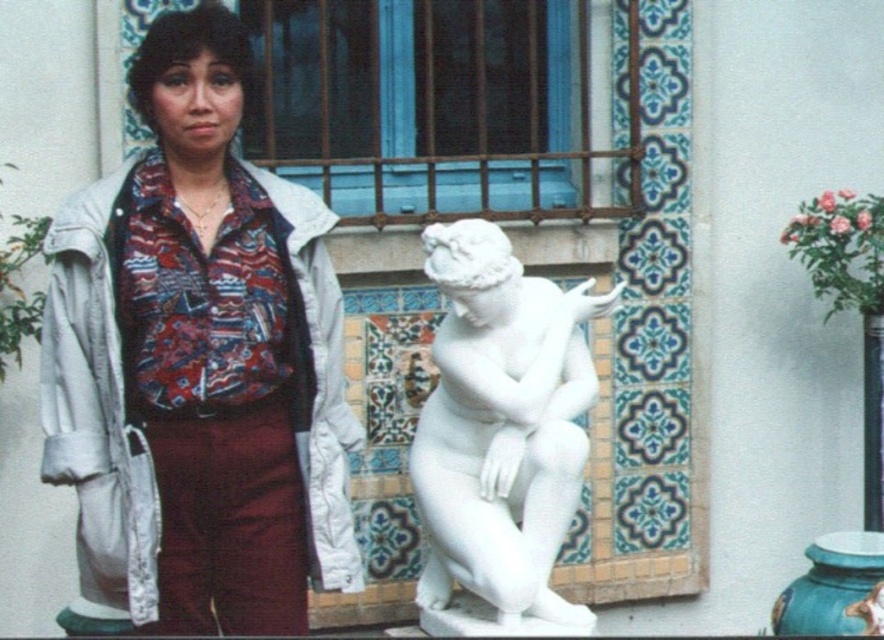
You are a photographer taking a picture of the scene. You notice the matte white blouse at center and the white marble statue at center. Which object should you focus on first if you want to ensure both are in sharp focus?

You should focus on the white marble statue at center first because it is further away than the matte white blouse at center, allowing the depth of field to cover both objects.

You are a photographer setting up a shoot. You need to position a light source to the right of both the matte white blouse at center and the white marble statue at center. Is this possible given their positions?

The matte white blouse at center is to the left of the white marble statue at center, so placing a light source to the right of both is possible as they are aligned horizontally.